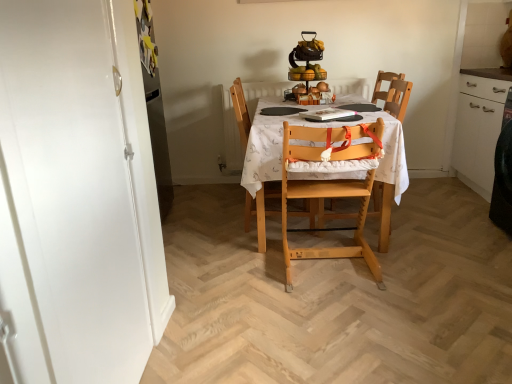
Identify the location of vacant space to the right of wooden highchair at center, arranged as the third chair when viewed from the left. The height and width of the screenshot is (384, 512). (411, 216).